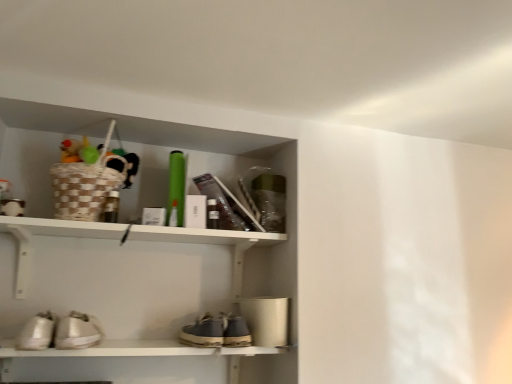
The width and height of the screenshot is (512, 384). I want to click on leather suede shoe at center, so click(x=234, y=331).

In order to click on leather suede shoe at center in this screenshot , I will do `click(234, 331)`.

Can you confirm if leather suede shoe at center is bigger than shiny metallic sneakers at lower left, placed as the 2th footwear when sorted from left to right?

Actually, leather suede shoe at center might be smaller than shiny metallic sneakers at lower left, placed as the 2th footwear when sorted from left to right.

Is leather suede shoe at center at the left side of shiny metallic sneakers at lower left, placed as the 2th footwear when sorted from left to right?

No, leather suede shoe at center is not to the left of shiny metallic sneakers at lower left, placed as the 2th footwear when sorted from left to right.

From the image's perspective, is leather suede shoe at center on top of shiny metallic sneakers at lower left, which is the 1th footwear from right to left?

No.

Is leather suede shoe at center taller than shiny metallic sneakers at lower left, which is the 1th footwear from right to left?

Incorrect, the height of leather suede shoe at center is not larger of that of shiny metallic sneakers at lower left, which is the 1th footwear from right to left.

Which is farther, (75, 313) or (44, 339)?

The point (75, 313) is farther.

Considering the relative sizes of shiny metallic sneakers at lower left, which is the 1th footwear from right to left, and white leather sneakers at lower left, arranged as the first footwear when viewed from the left, in the image provided, is shiny metallic sneakers at lower left, which is the 1th footwear from right to left, smaller than white leather sneakers at lower left, arranged as the first footwear when viewed from the left,?

No.

Is shiny metallic sneakers at lower left, placed as the 2th footwear when sorted from left to right, touching white leather sneakers at lower left, arranged as the first footwear when viewed from the left?

Yes, shiny metallic sneakers at lower left, placed as the 2th footwear when sorted from left to right, is in contact with white leather sneakers at lower left, arranged as the first footwear when viewed from the left.

Considering the relative positions of shiny metallic sneakers at lower left, placed as the 2th footwear when sorted from left to right, and white leather sneakers at lower left, positioned as the 2th footwear in right-to-left order, in the image provided, is shiny metallic sneakers at lower left, placed as the 2th footwear when sorted from left to right, to the right of white leather sneakers at lower left, positioned as the 2th footwear in right-to-left order, from the viewer's perspective?

Correct, you'll find shiny metallic sneakers at lower left, placed as the 2th footwear when sorted from left to right, to the right of white leather sneakers at lower left, positioned as the 2th footwear in right-to-left order.

Find the location of a particular element. the 2nd footwear above the leather suede shoe at center (from the image's perspective) is located at coordinates (37, 332).

Can you confirm if white leather sneakers at lower left, positioned as the 2th footwear in right-to-left order, is wider than leather suede shoe at center?

In fact, white leather sneakers at lower left, positioned as the 2th footwear in right-to-left order, might be narrower than leather suede shoe at center.

From a real-world perspective, between white leather sneakers at lower left, arranged as the first footwear when viewed from the left, and leather suede shoe at center, who is vertically higher?

leather suede shoe at center is physically above.

Between white leather sneakers at lower left, positioned as the 2th footwear in right-to-left order, and leather suede shoe at center, which one has more height?

Standing taller between the two is leather suede shoe at center.

Which is in front, point (82, 327) or point (229, 337)?

The point (82, 327) is more forward.

From a real-world perspective, which object rests below the other?

shiny metallic sneakers at lower left, which is the 1th footwear from right to left, from a real-world perspective.

From the image's perspective, is shiny metallic sneakers at lower left, which is the 1th footwear from right to left, located above or below leather suede shoe at center?

shiny metallic sneakers at lower left, which is the 1th footwear from right to left, is above leather suede shoe at center.

Is shiny metallic sneakers at lower left, placed as the 2th footwear when sorted from left to right, not close to leather suede shoe at center?

They are positioned close to each other.

From a real-world perspective, which is physically above, white matte shelf at upper center or shiny metallic sneakers at lower left, placed as the 2th footwear when sorted from left to right?

white matte shelf at upper center, from a real-world perspective.

From the image's perspective, is white matte shelf at upper center on top of shiny metallic sneakers at lower left, which is the 1th footwear from right to left?

Yes, from the image's perspective, white matte shelf at upper center is on top of shiny metallic sneakers at lower left, which is the 1th footwear from right to left.

The height and width of the screenshot is (384, 512). I want to click on shelf above the shiny metallic sneakers at lower left, which is the 1th footwear from right to left (from the image's perspective), so click(48, 235).

Is white matte shelf at upper center bigger or smaller than shiny metallic sneakers at lower left, placed as the 2th footwear when sorted from left to right?

white matte shelf at upper center is bigger than shiny metallic sneakers at lower left, placed as the 2th footwear when sorted from left to right.

Is shiny metallic sneakers at lower left, which is the 1th footwear from right to left, to the left or to the right of white matte shelf at upper center in the image?

Clearly, shiny metallic sneakers at lower left, which is the 1th footwear from right to left, is on the left of white matte shelf at upper center in the image.

Is shiny metallic sneakers at lower left, which is the 1th footwear from right to left, next to white matte shelf at upper center and touching it?

No, shiny metallic sneakers at lower left, which is the 1th footwear from right to left, is not in contact with white matte shelf at upper center.

From the image's perspective, between shiny metallic sneakers at lower left, placed as the 2th footwear when sorted from left to right, and white matte shelf at upper center, who is located below?

shiny metallic sneakers at lower left, placed as the 2th footwear when sorted from left to right.

Is white matte shelf at upper center surrounded by shiny metallic sneakers at lower left, which is the 1th footwear from right to left?

That's incorrect, white matte shelf at upper center is not inside shiny metallic sneakers at lower left, which is the 1th footwear from right to left.

Considering the sizes of objects leather suede shoe at center and white matte shelf at upper center in the image provided, who is bigger, leather suede shoe at center or white matte shelf at upper center?

white matte shelf at upper center.

Considering the relative sizes of leather suede shoe at center and white matte shelf at upper center in the image provided, is leather suede shoe at center shorter than white matte shelf at upper center?

Yes, leather suede shoe at center is shorter than white matte shelf at upper center.

From a real-world perspective, is leather suede shoe at center physically located above or below white matte shelf at upper center?

Clearly, from a real-world perspective, leather suede shoe at center is below white matte shelf at upper center.

Does point (231, 317) come behind point (123, 343)?

No, (231, 317) is closer to viewer.

Identify the location of the 1st footwear below the leather suede shoe at center (from a real-world perspective). The height and width of the screenshot is (384, 512). (78, 331).

This screenshot has height=384, width=512. Identify the location of footwear that appears on the right of white leather sneakers at lower left, arranged as the first footwear when viewed from the left. (78, 331).

Based on their spatial positions, is white leather sneakers at lower left, arranged as the first footwear when viewed from the left, or leather suede shoe at center further from shiny metallic sneakers at lower left, which is the 1th footwear from right to left?

leather suede shoe at center lies further to shiny metallic sneakers at lower left, which is the 1th footwear from right to left, than the other object.

Estimate the real-world distances between objects in this image. Which object is further from shiny metallic sneakers at lower left, which is the 1th footwear from right to left, white leather sneakers at lower left, arranged as the first footwear when viewed from the left, or white matte shelf at upper center?

white matte shelf at upper center.

Which object lies nearer to the anchor point leather suede shoe at center, white matte shelf at upper center or shiny metallic sneakers at lower left, which is the 1th footwear from right to left?

The object closer to leather suede shoe at center is white matte shelf at upper center.

Considering their positions, is shiny metallic sneakers at lower left, placed as the 2th footwear when sorted from left to right, positioned closer to white matte shelf at upper center than white leather sneakers at lower left, arranged as the first footwear when viewed from the left?

The object closer to white matte shelf at upper center is shiny metallic sneakers at lower left, placed as the 2th footwear when sorted from left to right.

Considering their positions, is shiny metallic sneakers at lower left, placed as the 2th footwear when sorted from left to right, positioned further to leather suede shoe at center than white matte shelf at upper center?

A: Among the two, shiny metallic sneakers at lower left, placed as the 2th footwear when sorted from left to right, is located further to leather suede shoe at center.

Based on their spatial positions, is leather suede shoe at center or white leather sneakers at lower left, arranged as the first footwear when viewed from the left, closer to shiny metallic sneakers at lower left, placed as the 2th footwear when sorted from left to right?

white leather sneakers at lower left, arranged as the first footwear when viewed from the left, lies closer to shiny metallic sneakers at lower left, placed as the 2th footwear when sorted from left to right, than the other object.

Based on their spatial positions, is white matte shelf at upper center or leather suede shoe at center closer to shiny metallic sneakers at lower left, which is the 1th footwear from right to left?

Among the two, white matte shelf at upper center is located nearer to shiny metallic sneakers at lower left, which is the 1th footwear from right to left.

From the picture: Looking at the image, which one is located closer to white matte shelf at upper center, white leather sneakers at lower left, arranged as the first footwear when viewed from the left, or shiny metallic sneakers at lower left, which is the 1th footwear from right to left?

Among the two, shiny metallic sneakers at lower left, which is the 1th footwear from right to left, is located nearer to white matte shelf at upper center.

Locate an element on the screen. This screenshot has height=384, width=512. footwear situated between white leather sneakers at lower left, arranged as the first footwear when viewed from the left, and leather suede shoe at center from left to right is located at coordinates (78, 331).

This screenshot has width=512, height=384. I want to click on shelf between white leather sneakers at lower left, positioned as the 2th footwear in right-to-left order, and leather suede shoe at center from left to right, so click(x=48, y=235).

Where is `shelf between shiny metallic sneakers at lower left, placed as the 2th footwear when sorted from left to right, and leather suede shoe at center, in the horizontal direction`? The image size is (512, 384). shelf between shiny metallic sneakers at lower left, placed as the 2th footwear when sorted from left to right, and leather suede shoe at center, in the horizontal direction is located at coordinates [x=48, y=235].

Locate an element on the screen. footwear situated between white leather sneakers at lower left, positioned as the 2th footwear in right-to-left order, and white matte shelf at upper center from left to right is located at coordinates (78, 331).